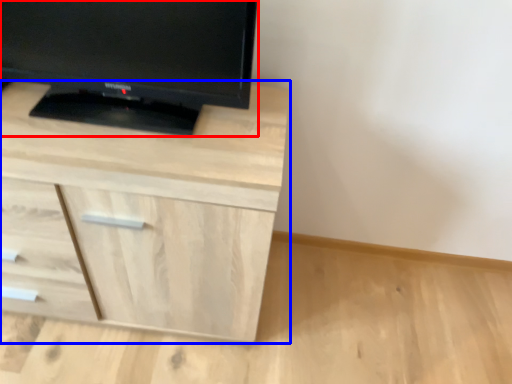
Question: Which object is closer to the camera taking this photo, television (highlighted by a red box) or chest of drawers (highlighted by a blue box)?

Choices:
 (A) television
 (B) chest of drawers

Answer: (A)